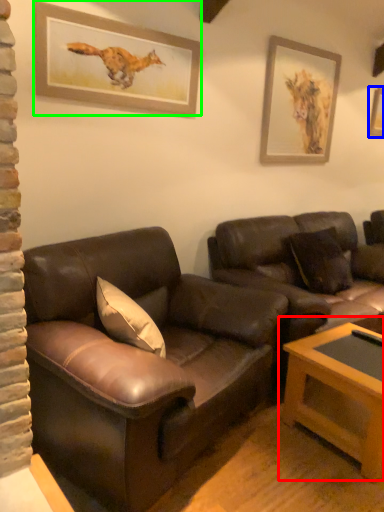
Question: Which object is positioned farthest from table (highlighted by a red box)? Select from picture frame (highlighted by a blue box) and picture frame (highlighted by a green box).

Choices:
 (A) picture frame
 (B) picture frame

Answer: (A)